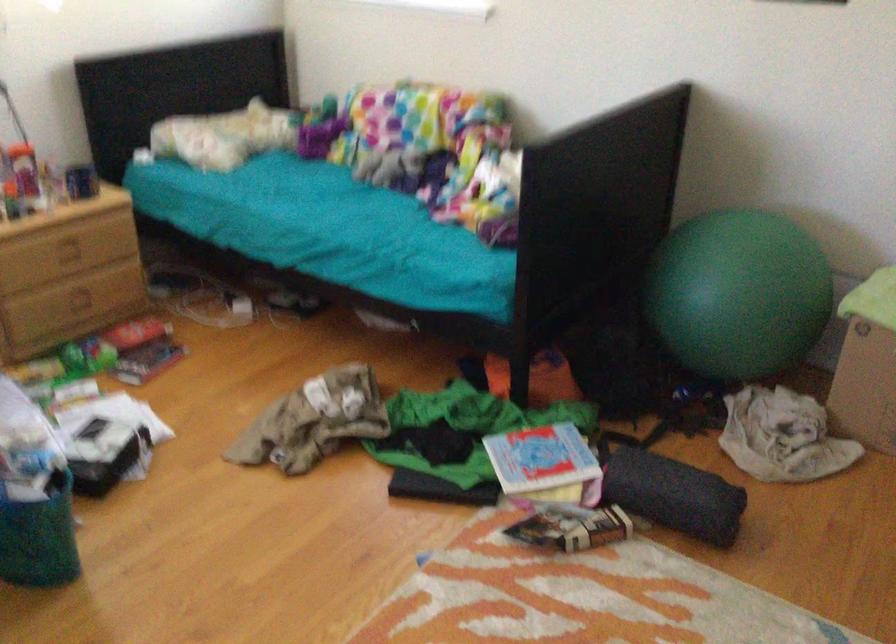
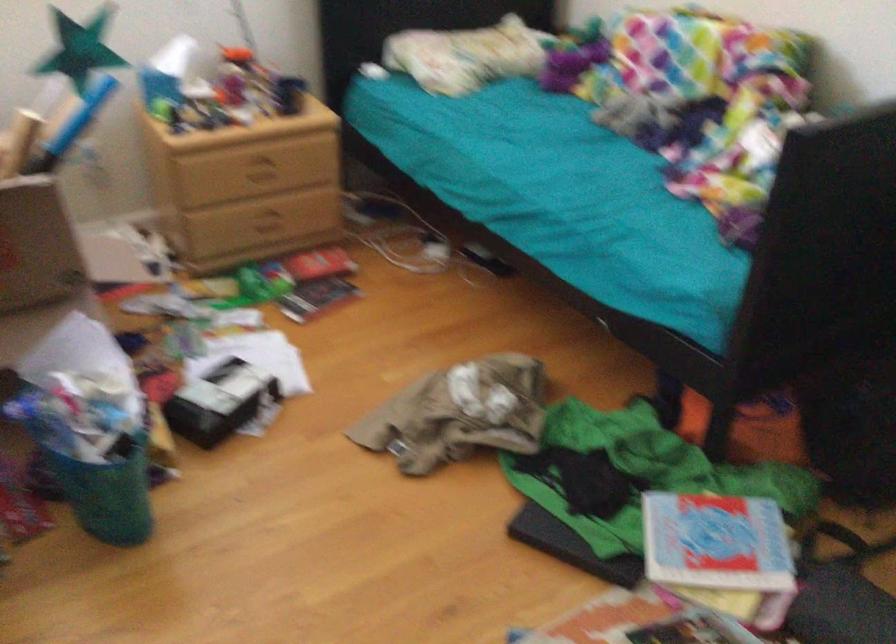
Find the pixel in the second image that matches point 539,462 in the first image.

(716, 542)